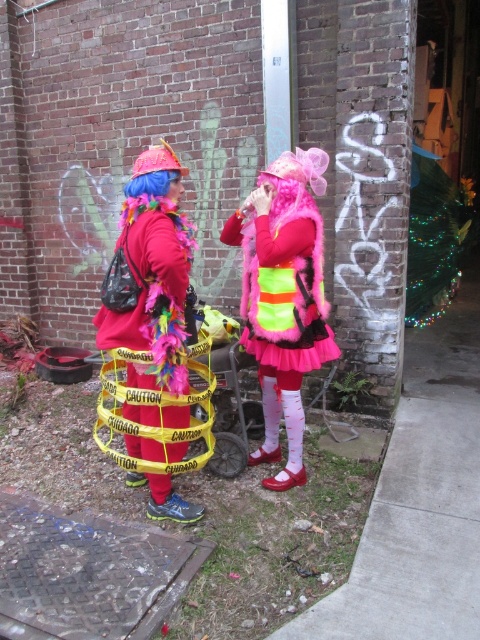
You are a photographer setting up for a photoshoot. You need to position a light source so that it illuminates both the neon yellow fabric skirt at center and the shiny metallic hoop at center equally. Considering their heights, should you place the light higher or lower than their midpoints?

The neon yellow fabric skirt at center is much taller than the shiny metallic hoop at center. To illuminate both equally, the light source should be placed higher than their midpoints so that the light can reach the top of the taller skirt and adequately cover the shorter hoop.

You are a photographer trying to capture the neon yellow fabric skirt at center and the shiny metallic hoop at center in a single frame. Based on their positions, which object should you adjust your camera angle to focus on first to ensure both are in the shot?

The neon yellow fabric skirt at center is positioned on the right side of the shiny metallic hoop at center. To capture both in a single frame, you should first focus on the shiny metallic hoop at center, then adjust the angle to include the neon yellow fabric skirt at center on its right side.